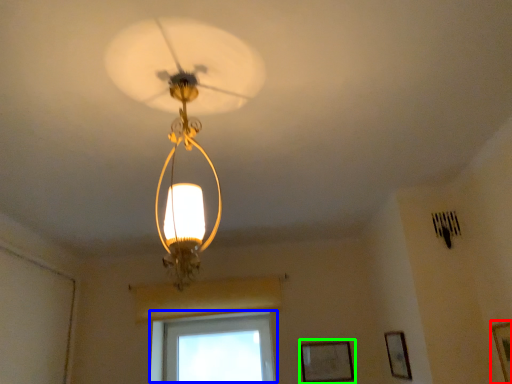
Question: Which is farther away from picture frame (highlighted by a red box)? window (highlighted by a blue box) or picture frame (highlighted by a green box)?

Choices:
 (A) window
 (B) picture frame

Answer: (A)